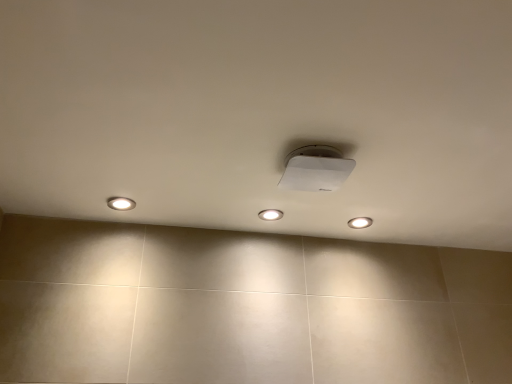
Image resolution: width=512 pixels, height=384 pixels. Describe the element at coordinates (360, 222) in the screenshot. I see `white glossy light fixture at upper center, the 1th dot viewed from the back` at that location.

Where is `matte white light at left, the third dot when ordered from back to front`? This screenshot has height=384, width=512. matte white light at left, the third dot when ordered from back to front is located at coordinates (121, 203).

Looking at this image, does white glossy light fixture at center, arranged as the second dot when viewed from the front, have a smaller size compared to white glossy light fixture at upper center, which appears as the third dot when viewed from the left?

No.

From a real-world perspective, which object rests below the other?

white glossy light fixture at upper center, acting as the 3th dot starting from the front, from a real-world perspective.

Could you measure the distance between white glossy light fixture at center, acting as the second dot starting from the left, and white glossy light fixture at upper center, acting as the 3th dot starting from the front?

white glossy light fixture at center, acting as the second dot starting from the left, and white glossy light fixture at upper center, acting as the 3th dot starting from the front, are 30.80 centimeters apart.

Is white glossy light fixture at center, which appears as the 2th dot when viewed from the back, to the left of matte white light at left, the third dot when ordered from back to front, from the viewer's perspective?

No, white glossy light fixture at center, which appears as the 2th dot when viewed from the back, is not to the left of matte white light at left, the third dot when ordered from back to front.

Is white glossy light fixture at center, placed as the second dot when sorted from right to left, outside of matte white light at left, acting as the first dot starting from the left?

That's correct, white glossy light fixture at center, placed as the second dot when sorted from right to left, is outside of matte white light at left, acting as the first dot starting from the left.

Are white glossy light fixture at center, arranged as the second dot when viewed from the front, and matte white light at left, the 3th dot when ordered from right to left, far apart?

No, white glossy light fixture at center, arranged as the second dot when viewed from the front, is not far away from matte white light at left, the 3th dot when ordered from right to left.

What's the angular difference between white glossy light fixture at upper center, acting as the 3th dot starting from the front, and white plastic lamp at center's facing directions?

The angle between the facing direction of white glossy light fixture at upper center, acting as the 3th dot starting from the front, and the facing direction of white plastic lamp at center is 1.07 degrees.

Is white glossy light fixture at upper center, acting as the 3th dot starting from the front, not inside white plastic lamp at center?

Yes.

Image resolution: width=512 pixels, height=384 pixels. I want to click on the 3rd dot below the white plastic lamp at center (from the image's perspective), so click(x=360, y=222).

Could you tell me if white glossy light fixture at upper center, the 1th dot viewed from the back, is facing white plastic lamp at center?

No, white glossy light fixture at upper center, the 1th dot viewed from the back, is not turned towards white plastic lamp at center.

Which is nearer, (317,183) or (362,218)?

The point (317,183) is more forward.

Is white plastic lamp at center not near white glossy light fixture at upper center, the 1th dot viewed from the back?

They are positioned close to each other.

Is white plastic lamp at center taller or shorter than white glossy light fixture at upper center, which is the first dot in right-to-left order?

Clearly, white plastic lamp at center is taller compared to white glossy light fixture at upper center, which is the first dot in right-to-left order.

Considering the sizes of objects white plastic lamp at center and white glossy light fixture at upper center, which is the first dot in right-to-left order, in the image provided, who is smaller, white plastic lamp at center or white glossy light fixture at upper center, which is the first dot in right-to-left order,?

white glossy light fixture at upper center, which is the first dot in right-to-left order.

Is white glossy light fixture at upper center, which appears as the third dot when viewed from the left, thinner than matte white light at left, the third dot when ordered from back to front?

Correct, the width of white glossy light fixture at upper center, which appears as the third dot when viewed from the left, is less than that of matte white light at left, the third dot when ordered from back to front.

From a real-world perspective, which dot is the 1st one above the white glossy light fixture at upper center, which is the first dot in right-to-left order? Please provide its 2D coordinates.

[(121, 203)]

Is white glossy light fixture at upper center, the 1th dot viewed from the back, touching matte white light at left, the 3th dot when ordered from right to left?

No, white glossy light fixture at upper center, the 1th dot viewed from the back, is not with matte white light at left, the 3th dot when ordered from right to left.

Who is bigger, white glossy light fixture at upper center, which is the first dot in right-to-left order, or matte white light at left, the third dot when ordered from back to front?

With larger size is matte white light at left, the third dot when ordered from back to front.

From a real-world perspective, which object stands above the other?

In real-world perspective, white glossy light fixture at center, placed as the second dot when sorted from right to left, is above.

Does point (109, 205) come closer to viewer compared to point (268, 214)?

Yes, point (109, 205) is in front of point (268, 214).

From the image's perspective, between matte white light at left, acting as the first dot starting from the left, and white glossy light fixture at center, placed as the second dot when sorted from right to left, who is located below?

white glossy light fixture at center, placed as the second dot when sorted from right to left.

From a real-world perspective, which is physically below, white glossy light fixture at center, placed as the second dot when sorted from right to left, or white plastic lamp at center?

white plastic lamp at center is physically lower.

Does point (276, 219) come farther from viewer compared to point (310, 185)?

Yes.

Looking at this image, could you measure the distance between white glossy light fixture at center, placed as the second dot when sorted from right to left, and white plastic lamp at center?

white glossy light fixture at center, placed as the second dot when sorted from right to left, is 13.80 inches from white plastic lamp at center.

Considering the relative sizes of white glossy light fixture at center, acting as the second dot starting from the left, and white plastic lamp at center in the image provided, is white glossy light fixture at center, acting as the second dot starting from the left, smaller than white plastic lamp at center?

Yes, white glossy light fixture at center, acting as the second dot starting from the left, is smaller than white plastic lamp at center.

Find the location of a particular element. This screenshot has width=512, height=384. the 1st dot to the left of the white glossy light fixture at upper center, acting as the 3th dot starting from the front, counting from the anchor's position is located at coordinates (270, 214).

Where is `dot above the matte white light at left, the 3th dot when ordered from right to left (from a real-world perspective)`? This screenshot has width=512, height=384. dot above the matte white light at left, the 3th dot when ordered from right to left (from a real-world perspective) is located at coordinates point(270,214).

When comparing their distances from white plastic lamp at center, does white glossy light fixture at center, acting as the second dot starting from the left, or white glossy light fixture at upper center, which appears as the third dot when viewed from the left, seem closer?

The object closer to white plastic lamp at center is white glossy light fixture at center, acting as the second dot starting from the left.

Looking at the image, which one is located closer to white plastic lamp at center, matte white light at left, the 3th dot when ordered from right to left, or white glossy light fixture at center, placed as the second dot when sorted from right to left?

white glossy light fixture at center, placed as the second dot when sorted from right to left, is closer to white plastic lamp at center.

Based on their spatial positions, is matte white light at left, which is counted as the 1th dot, starting from the front, or white glossy light fixture at upper center, the 1th dot viewed from the back, closer to white glossy light fixture at center, acting as the second dot starting from the left?

white glossy light fixture at upper center, the 1th dot viewed from the back, lies closer to white glossy light fixture at center, acting as the second dot starting from the left, than the other object.

Estimate the real-world distances between objects in this image. Which object is further from white glossy light fixture at upper center, acting as the 3th dot starting from the front, white plastic lamp at center or matte white light at left, the third dot when ordered from back to front?

matte white light at left, the third dot when ordered from back to front, is further to white glossy light fixture at upper center, acting as the 3th dot starting from the front.

Looking at the image, which one is located further to white glossy light fixture at upper center, which is the first dot in right-to-left order, white plastic lamp at center or white glossy light fixture at center, placed as the second dot when sorted from right to left?

Among the two, white plastic lamp at center is located further to white glossy light fixture at upper center, which is the first dot in right-to-left order.

In the scene shown: Considering their positions, is white glossy light fixture at upper center, acting as the 3th dot starting from the front, positioned closer to white glossy light fixture at center, arranged as the second dot when viewed from the front, than white plastic lamp at center?

Based on the image, white glossy light fixture at upper center, acting as the 3th dot starting from the front, appears to be nearer to white glossy light fixture at center, arranged as the second dot when viewed from the front.

From the image, which object appears to be nearer to matte white light at left, the 3th dot when ordered from right to left, white glossy light fixture at upper center, which appears as the third dot when viewed from the left, or white glossy light fixture at center, acting as the second dot starting from the left?

white glossy light fixture at center, acting as the second dot starting from the left.

When comparing their distances from white plastic lamp at center, does white glossy light fixture at center, placed as the second dot when sorted from right to left, or matte white light at left, acting as the first dot starting from the left, seem closer?

white glossy light fixture at center, placed as the second dot when sorted from right to left, lies closer to white plastic lamp at center than the other object.

The height and width of the screenshot is (384, 512). Identify the location of dot located between matte white light at left, acting as the first dot starting from the left, and white glossy light fixture at upper center, acting as the 3th dot starting from the front, in the left-right direction. (270, 214).

Find the location of a particular element. The image size is (512, 384). dot situated between matte white light at left, the third dot when ordered from back to front, and white plastic lamp at center from left to right is located at coordinates (270, 214).

Image resolution: width=512 pixels, height=384 pixels. I want to click on lamp between matte white light at left, the 3th dot when ordered from right to left, and white glossy light fixture at upper center, acting as the 3th dot starting from the front, so (315, 169).